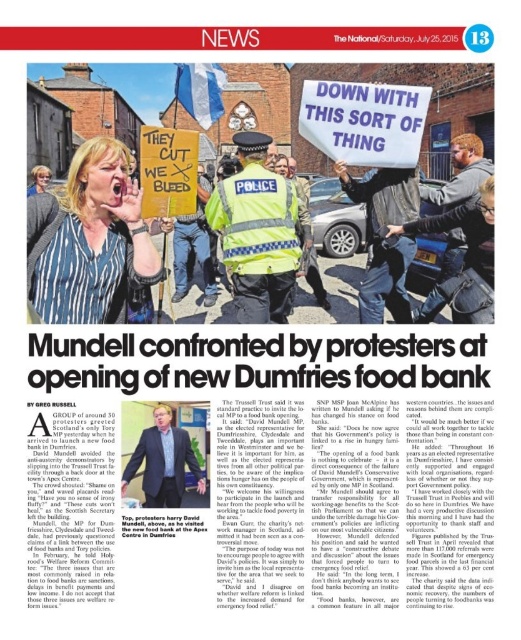
Question: Can you confirm if white fabric banner at upper center is smaller than blue fabric bag at center?

Choices:
 (A) yes
 (B) no

Answer: (A)

Question: Which object appears farthest from the camera in this image?

Choices:
 (A) dark blue uniform at center
 (B) white fabric banner at upper center

Answer: (A)

Question: Among these points, which one is nearest to the camera?

Choices:
 (A) (432, 228)
 (B) (125, 259)
 (C) (48, 176)
 (D) (130, 460)

Answer: (D)

Question: Is formal suit at center behind yellow safety vest at center?

Choices:
 (A) no
 (B) yes

Answer: (A)

Question: Which object appears closest to the camera in this image?

Choices:
 (A) dark blue uniform at center
 (B) striped fabric blouse at upper center

Answer: (B)

Question: Is striped fabric blouse at upper center to the left of blonde hair at upper left from the viewer's perspective?

Choices:
 (A) no
 (B) yes

Answer: (A)